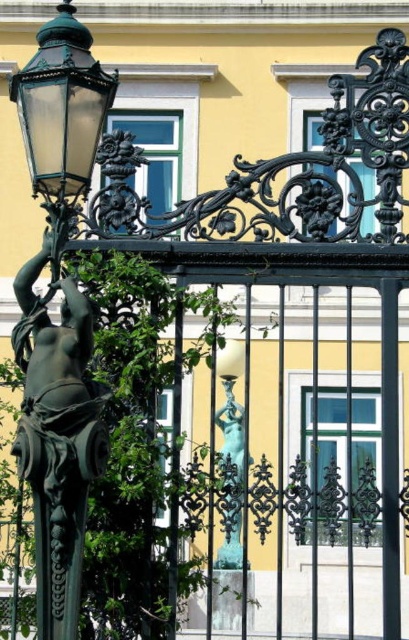
Question: Does bronze/golden statue at left appear on the right side of green glass streetlight at left?

Choices:
 (A) yes
 (B) no

Answer: (A)

Question: Does bronze/golden statue at left have a smaller size compared to green glass streetlight at left?

Choices:
 (A) yes
 (B) no

Answer: (B)

Question: Which point appears farthest from the camera in this image?

Choices:
 (A) (38, 352)
 (B) (89, 129)
 (C) (224, 436)

Answer: (C)

Question: Which object is farther from the camera taking this photo?

Choices:
 (A) green glass streetlight at left
 (B) bronze/golden statue at left

Answer: (A)

Question: Which of the following is the closest to the observer?

Choices:
 (A) shiny bronze statue at center
 (B) bronze/golden statue at left

Answer: (B)

Question: Can you confirm if green glass streetlight at left is positioned to the left of shiny bronze statue at center?

Choices:
 (A) no
 (B) yes

Answer: (B)